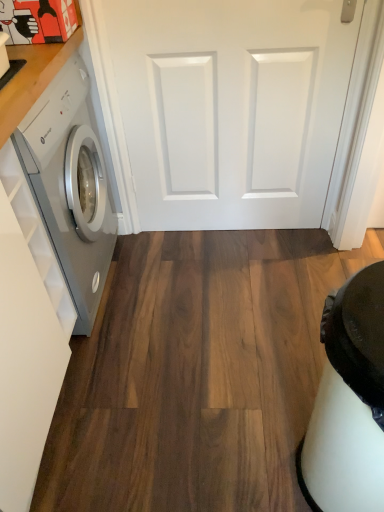
Where is `satin white washing machine at left`? The image size is (384, 512). satin white washing machine at left is located at coordinates (70, 187).

What do you see at coordinates (70, 187) in the screenshot? Image resolution: width=384 pixels, height=512 pixels. I see `satin white washing machine at left` at bounding box center [70, 187].

Where is `white matte door at center`? The height and width of the screenshot is (512, 384). white matte door at center is located at coordinates (226, 108).

The width and height of the screenshot is (384, 512). Describe the element at coordinates (226, 108) in the screenshot. I see `white matte door at center` at that location.

In order to click on satin white washing machine at left in this screenshot , I will do `click(70, 187)`.

Considering the relative positions of white matte door at center and satin white washing machine at left in the image provided, is white matte door at center to the left of satin white washing machine at left from the viewer's perspective?

No.

Does white matte door at center lie behind satin white washing machine at left?

Yes, it is behind satin white washing machine at left.

Which point is more distant from viewer, (231, 127) or (70, 247)?

The point (231, 127) is behind.

From the image's perspective, is white matte door at center positioned above or below satin white washing machine at left?

From the image's perspective, white matte door at center appears above satin white washing machine at left.

From a real-world perspective, is white matte door at center positioned over satin white washing machine at left based on gravity?

No, from a real-world perspective, white matte door at center is not above satin white washing machine at left.

Can you confirm if white matte door at center is wider than satin white washing machine at left?

In fact, white matte door at center might be narrower than satin white washing machine at left.

Is white matte door at center taller than satin white washing machine at left?

In fact, white matte door at center may be shorter than satin white washing machine at left.

Which of these two, white matte door at center or satin white washing machine at left, is smaller?

white matte door at center is smaller.

Is white matte door at center located outside satin white washing machine at left?

Indeed, white matte door at center is completely outside satin white washing machine at left.

Are white matte door at center and satin white washing machine at left making contact?

No.

Is white matte door at center looking in the opposite direction of satin white washing machine at left?

white matte door at center is not turned away from satin white washing machine at left.

Image resolution: width=384 pixels, height=512 pixels. Find the location of `door directly beneath the satin white washing machine at left (from a real-world perspective)`. door directly beneath the satin white washing machine at left (from a real-world perspective) is located at coordinates (226, 108).

Considering the positions of objects satin white washing machine at left and white matte door at center in the image provided, who is more to the right, satin white washing machine at left or white matte door at center?

From the viewer's perspective, white matte door at center appears more on the right side.

In the image, is satin white washing machine at left positioned in front of or behind white matte door at center?

satin white washing machine at left is positioned closer to the viewer than white matte door at center.

Is point (49, 208) closer to camera compared to point (332, 9)?

Yes, point (49, 208) is in front of point (332, 9).

From the image's perspective, is satin white washing machine at left located beneath white matte door at center?

Yes.

From a real-world perspective, which object rests below the other?

white matte door at center.

In the scene shown: Does satin white washing machine at left have a greater width compared to white matte door at center?

Yes.

Considering the sizes of objects satin white washing machine at left and white matte door at center in the image provided, who is taller, satin white washing machine at left or white matte door at center?

satin white washing machine at left is taller.

Does satin white washing machine at left have a larger size compared to white matte door at center?

Correct, satin white washing machine at left is larger in size than white matte door at center.

Is satin white washing machine at left located outside white matte door at center?

satin white washing machine at left lies outside white matte door at center's area.

Is satin white washing machine at left directly adjacent to white matte door at center?

No, satin white washing machine at left is not beside white matte door at center.

Is white matte door at center at the back of satin white washing machine at left?

No.

What's the angular difference between satin white washing machine at left and white matte door at center's facing directions?

The facing directions of satin white washing machine at left and white matte door at center are 89.4 degrees apart.

How distant is satin white washing machine at left from white matte door at center?

18.32 inches.

Identify the location of door on the right of the satin white washing machine at left. (226, 108).

Locate an element on the screen. The width and height of the screenshot is (384, 512). door behind the satin white washing machine at left is located at coordinates (226, 108).

I want to click on door above the satin white washing machine at left (from the image's perspective), so tap(226, 108).